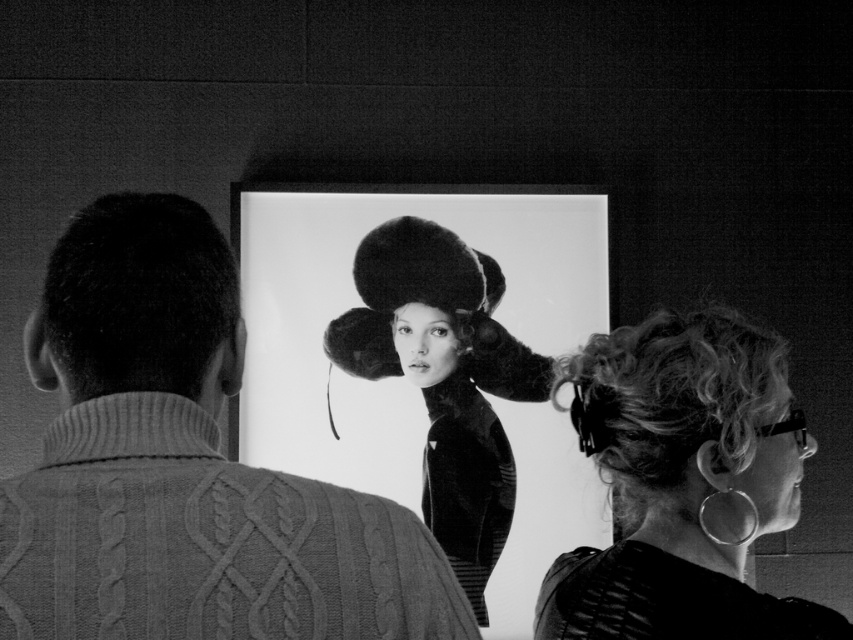
Question: Considering the real-world distances, which object is farthest from the leather jacket at right?

Choices:
 (A) dark curly hair at left
 (B) cable-knit sweater at center

Answer: (A)

Question: Does leather jacket at right appear under fuzzy fur hat at center?

Choices:
 (A) yes
 (B) no

Answer: (B)

Question: Is fuzzy fur hat at center to the right of dark curly hair at left from the viewer's perspective?

Choices:
 (A) no
 (B) yes

Answer: (B)

Question: Can you confirm if cable-knit sweater at center is thinner than leather jacket at right?

Choices:
 (A) no
 (B) yes

Answer: (A)

Question: Estimate the real-world distances between objects in this image. Which object is farther from the cable-knit sweater at center?

Choices:
 (A) fuzzy fur hat at center
 (B) leather jacket at right
 (C) dark curly hair at left

Answer: (A)

Question: Which of the following is the closest to the observer?

Choices:
 (A) cable-knit sweater at center
 (B) fuzzy fur hat at center

Answer: (A)